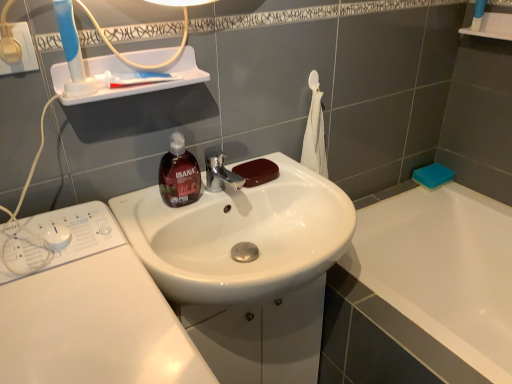
Question: Considering the relative positions of translucent brown soap dispenser at center and brown matte soap at sink, which is the first soap in front-to-back order, in the image provided, is translucent brown soap dispenser at center to the right of brown matte soap at sink, which is the first soap in front-to-back order, from the viewer's perspective?

Choices:
 (A) no
 (B) yes

Answer: (A)

Question: Is translucent brown soap dispenser at center wider than brown matte soap at sink, which is the first soap in front-to-back order?

Choices:
 (A) yes
 (B) no

Answer: (B)

Question: Is translucent brown soap dispenser at center outside brown matte soap at sink, which is the first soap in front-to-back order?

Choices:
 (A) yes
 (B) no

Answer: (A)

Question: Is translucent brown soap dispenser at center at the left side of brown matte soap at sink, the second soap viewed from the right?

Choices:
 (A) yes
 (B) no

Answer: (A)

Question: From a real-world perspective, is translucent brown soap dispenser at center physically below brown matte soap at sink, which is the 1th soap from left to right?

Choices:
 (A) yes
 (B) no

Answer: (B)

Question: Would you consider translucent brown soap dispenser at center to be distant from brown matte soap at sink, which is the 1th soap from left to right?

Choices:
 (A) yes
 (B) no

Answer: (B)

Question: Is translucent brown soap dispenser at center further to camera compared to white glossy sink at center?

Choices:
 (A) yes
 (B) no

Answer: (A)

Question: Is translucent brown soap dispenser at center touching white glossy sink at center?

Choices:
 (A) yes
 (B) no

Answer: (B)

Question: Does translucent brown soap dispenser at center have a smaller size compared to white glossy sink at center?

Choices:
 (A) no
 (B) yes

Answer: (B)

Question: Is translucent brown soap dispenser at center positioned in front of white glossy sink at center?

Choices:
 (A) yes
 (B) no

Answer: (B)

Question: Would you consider translucent brown soap dispenser at center to be distant from white glossy sink at center?

Choices:
 (A) yes
 (B) no

Answer: (B)

Question: Is translucent brown soap dispenser at center aimed at white glossy sink at center?

Choices:
 (A) no
 (B) yes

Answer: (A)

Question: Considering the relative sizes of blue plastic toothbrush at upper left and white glossy washing machine at lower left in the image provided, is blue plastic toothbrush at upper left bigger than white glossy washing machine at lower left?

Choices:
 (A) yes
 (B) no

Answer: (B)